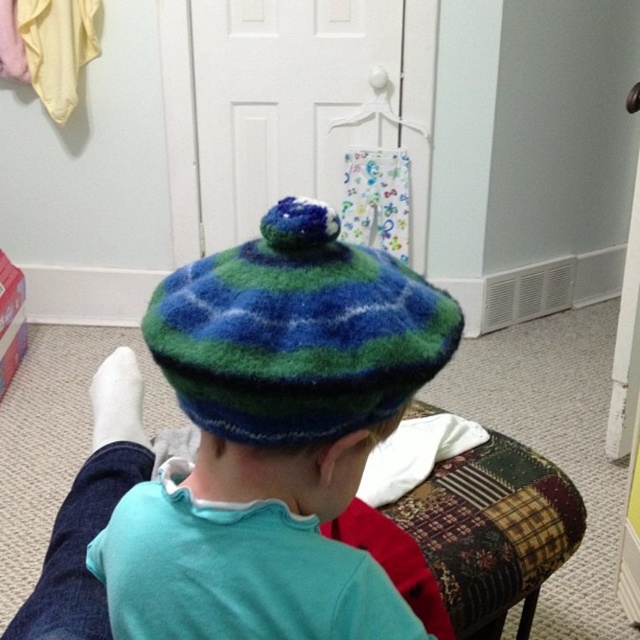
Based on the photo, you are a visitor in this room and want to sit down. Where is the patchwork fabric stool at center located?

The patchwork fabric stool at center is located at point (474, 538).

You are a parent trying to put a hat on your child. The multicolored fuzzy beret at center is currently resting on the patchwork fabric stool at center. Can you easily pick it up to place it on the child?

The multicolored fuzzy beret at center is shorter than the patchwork fabric stool at center, so it is positioned below the stool. Since the beret is resting on the stool, you can easily pick it up from there to place it on the child.

You are a parent looking for your child who is sitting near the patchwork fabric stool at center. You see the white plastic hanger at upper center in the background. Which object is closer to the child?

The patchwork fabric stool at center is closer to the child since it is located below the white plastic hanger at upper center, placing it lower and nearer in the scene.